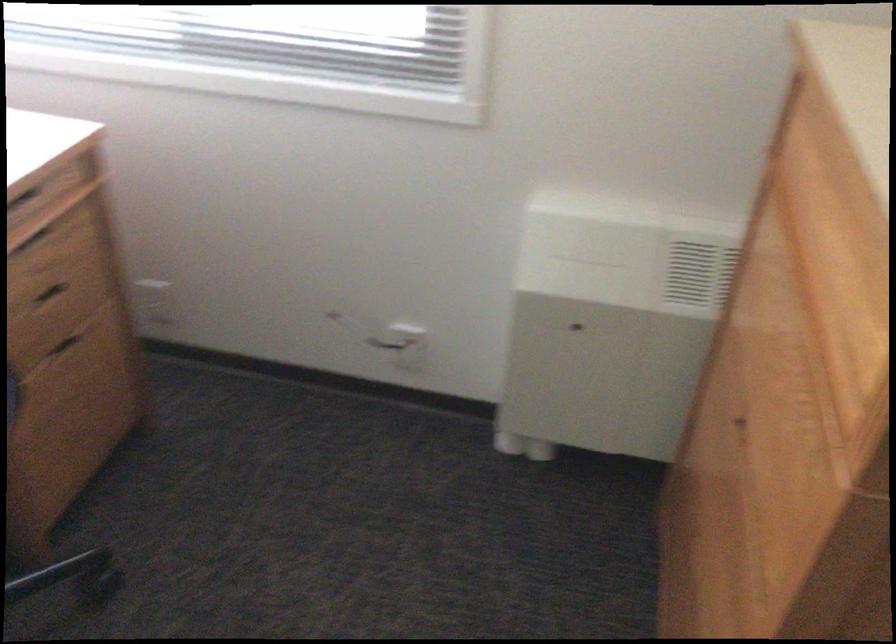
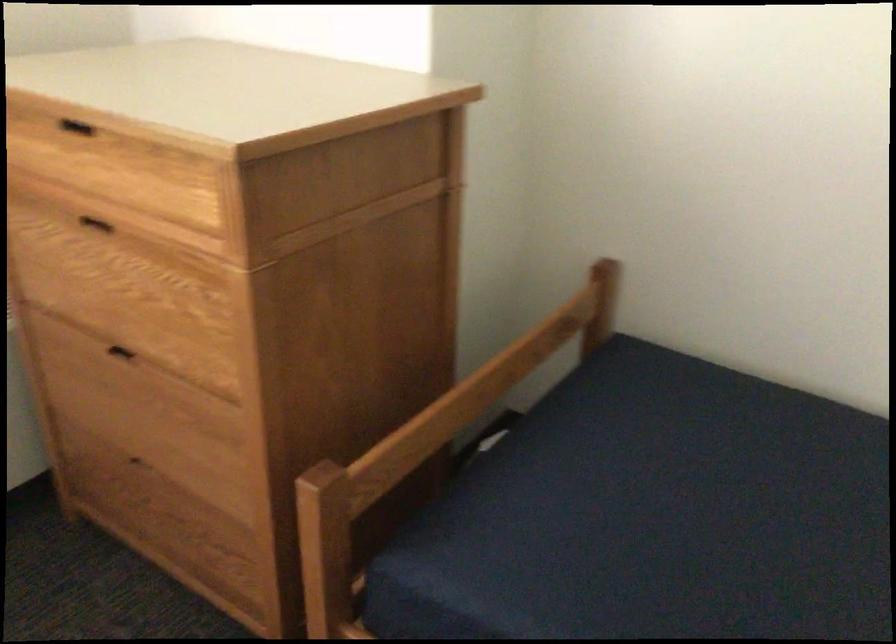
Locate, in the second image, the point that corresponds to the point at 798,272 in the first image.

(96, 223)